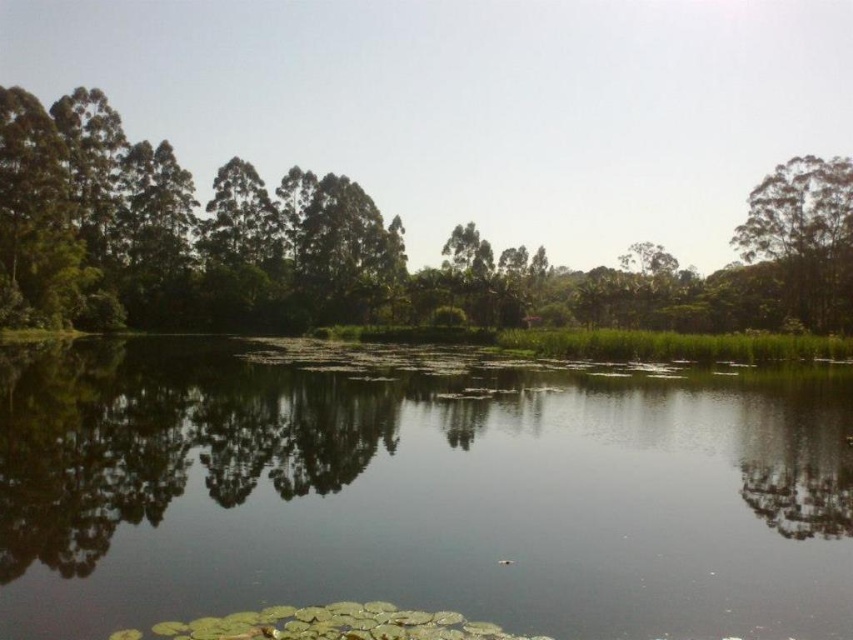
Looking at this image, does green leafy trees at center have a smaller size compared to green leafy tree at upper right?

Actually, green leafy trees at center might be larger than green leafy tree at upper right.

Does point (403, 253) lie in front of point (846, 314)?

That is False.

Image resolution: width=853 pixels, height=640 pixels. What are the coordinates of `green leafy trees at center` in the screenshot? It's located at (355, 244).

Can you confirm if green leafy water at center is taller than green leafy trees at center?

Incorrect, green leafy water at center's height is not larger of green leafy trees at center's.

Identify the location of green leafy water at center. (419, 493).

You are a GUI agent. You are given a task and a screenshot of the screen. Output one action in this format:
    pyautogui.click(x=<x>, y=<y>)
    Task: Click on the green leafy water at center
    
    Given the screenshot: What is the action you would take?
    pyautogui.click(x=419, y=493)

Which is below, green leafy water at center or green leafy tree at upper right?

Positioned lower is green leafy water at center.

In the scene shown: Is green leafy water at center thinner than green leafy tree at upper right?

No, green leafy water at center is not thinner than green leafy tree at upper right.

Find the location of a particular element. The width and height of the screenshot is (853, 640). green leafy water at center is located at coordinates (419, 493).